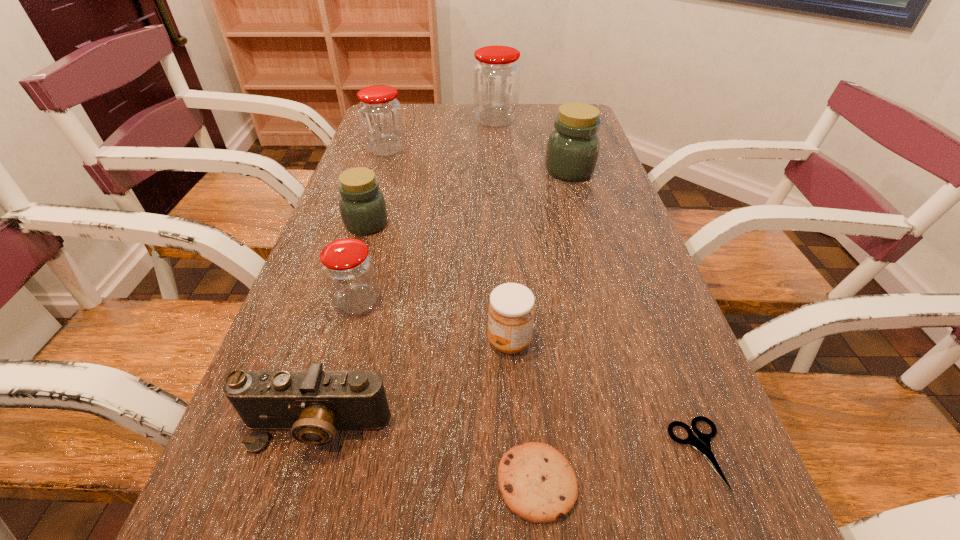
The width and height of the screenshot is (960, 540). What are the coordinates of `the farthest red jar` in the screenshot? It's located at (496, 75).

You are a GUI agent. You are given a task and a screenshot of the screen. Output one action in this format:
    pyautogui.click(x=<x>, y=<y>)
    Task: Click on the rightmost red jar
    
    Given the screenshot: What is the action you would take?
    pyautogui.click(x=496, y=75)

You are a GUI agent. You are given a task and a screenshot of the screen. Output one action in this format:
    pyautogui.click(x=<x>, y=<y>)
    Task: Click on the farther green jar
    
    Given the screenshot: What is the action you would take?
    pyautogui.click(x=572, y=151)

Locate an element on the screen. The height and width of the screenshot is (540, 960). the rightmost jar is located at coordinates (572, 151).

This screenshot has height=540, width=960. In order to click on the second smallest red jar in this screenshot , I will do `click(380, 115)`.

This screenshot has width=960, height=540. What are the coordinates of `the nearer green jar` in the screenshot? It's located at (363, 210).

Locate an element on the screen. the sixth nearest object is located at coordinates (363, 210).

Identify the location of the nearest jar. Image resolution: width=960 pixels, height=540 pixels. (347, 267).

Find the location of a particular element. the smallest red jar is located at coordinates (347, 267).

Identify the location of jam. (511, 309).